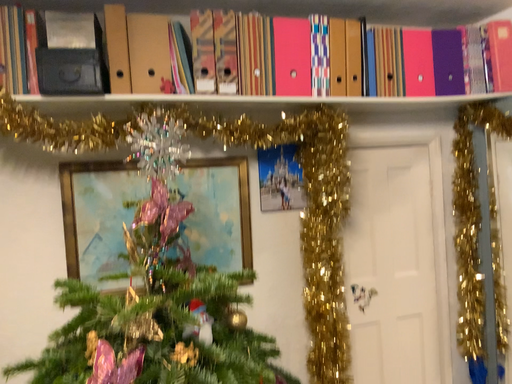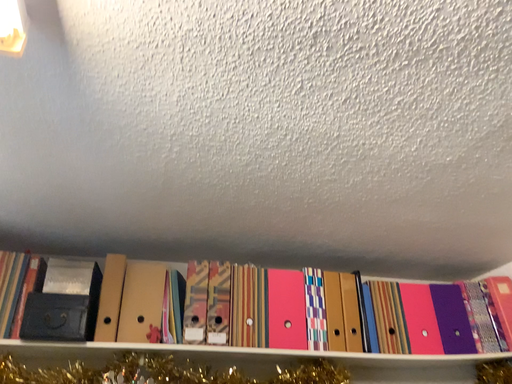
Question: Which way did the camera rotate in the video?

Choices:
 (A) rotated downward
 (B) rotated upward

Answer: (B)